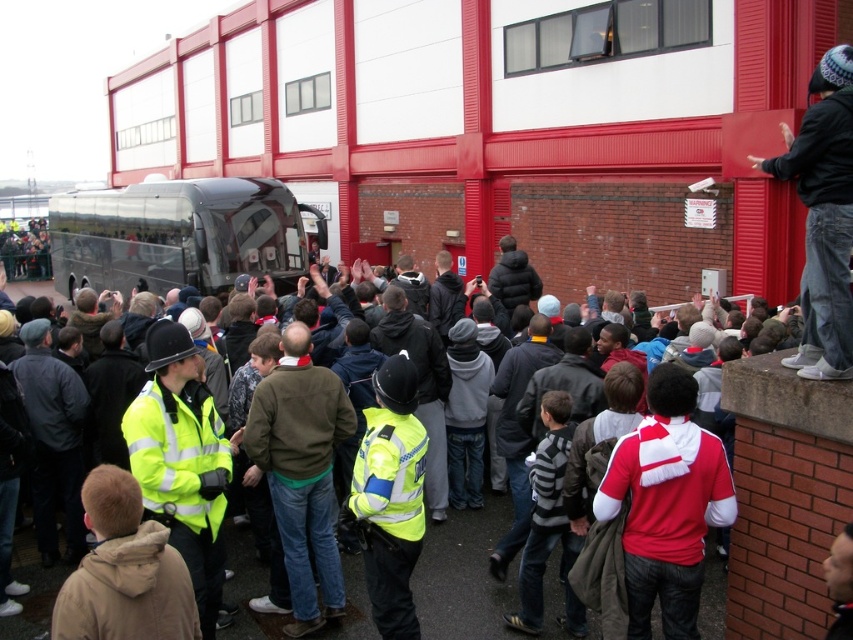
Question: Does matte black bus at center have a lesser width compared to red and white jersey at center?

Choices:
 (A) no
 (B) yes

Answer: (B)

Question: Which point is farther from the camera taking this photo?

Choices:
 (A) (659, 477)
 (B) (496, 611)
 (C) (67, 278)

Answer: (C)

Question: In this image, where is shiny black bus at center located relative to red and white jersey at center?

Choices:
 (A) right
 (B) left

Answer: (B)

Question: Observing the image, what is the correct spatial positioning of matte black bus at center in reference to red and white jersey at center?

Choices:
 (A) above
 (B) below

Answer: (B)

Question: Which point is farther from the camera taking this photo?

Choices:
 (A) (488, 616)
 (B) (73, 260)
 (C) (664, 621)

Answer: (B)

Question: Which object is positioned farthest from the matte black bus at center?

Choices:
 (A) red and white jersey at center
 (B) shiny black bus at center

Answer: (B)